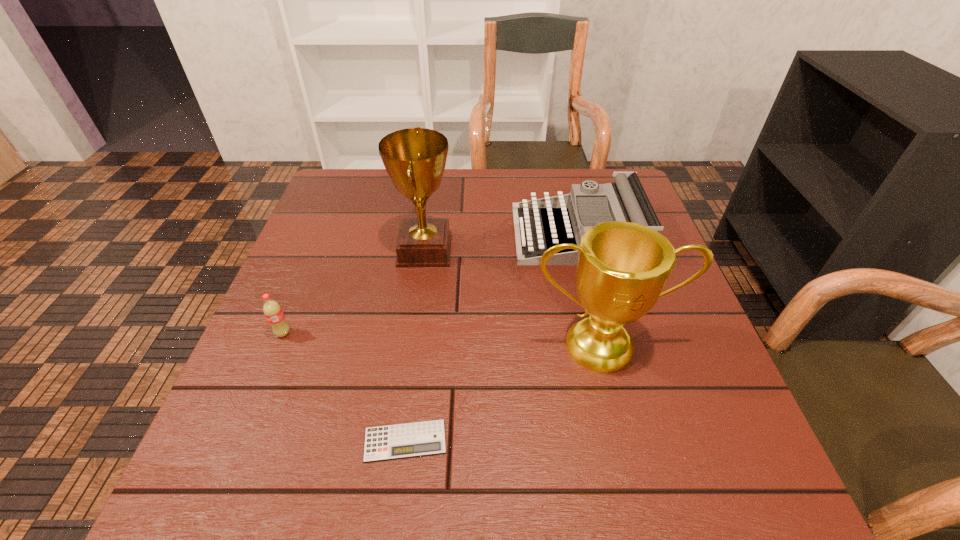
This screenshot has width=960, height=540. I want to click on free spot located on the typing side of the typewriter, so click(385, 234).

Where is `vacant space situated 0.090m on the front of the leftmost object`? Image resolution: width=960 pixels, height=540 pixels. vacant space situated 0.090m on the front of the leftmost object is located at coordinates (265, 377).

Locate an element on the screen. The height and width of the screenshot is (540, 960). free spot located 0.320m on the back of the calculator is located at coordinates (424, 291).

You are a GUI agent. You are given a task and a screenshot of the screen. Output one action in this format:
    pyautogui.click(x=<x>, y=<y>)
    Task: Click on the object positioned at the far edge
    This screenshot has width=960, height=540.
    Given the screenshot: What is the action you would take?
    pos(626,200)

Identify the location of object at the near edge. The image size is (960, 540). (399, 441).

Find the location of a particular element. The image size is (960, 540). object located at the left edge is located at coordinates pyautogui.click(x=273, y=312).

The height and width of the screenshot is (540, 960). I want to click on award located at the right edge, so click(622, 268).

Identify the location of typewriter at the right edge. The image size is (960, 540). (626, 200).

Identify the location of object present at the far right corner. This screenshot has height=540, width=960. (626, 200).

Image resolution: width=960 pixels, height=540 pixels. In the image, there is a desktop. What are the coordinates of `free space at the far edge` in the screenshot? It's located at (438, 207).